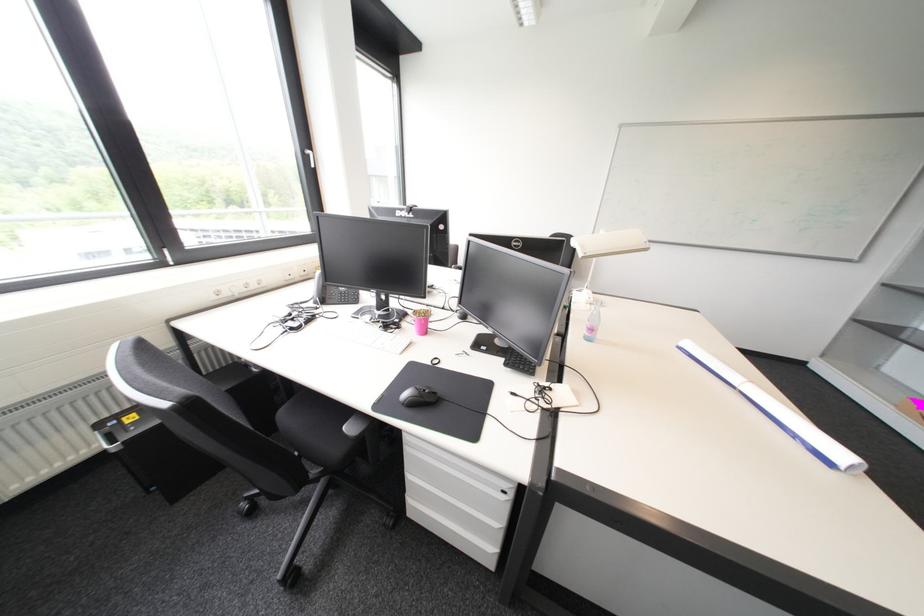
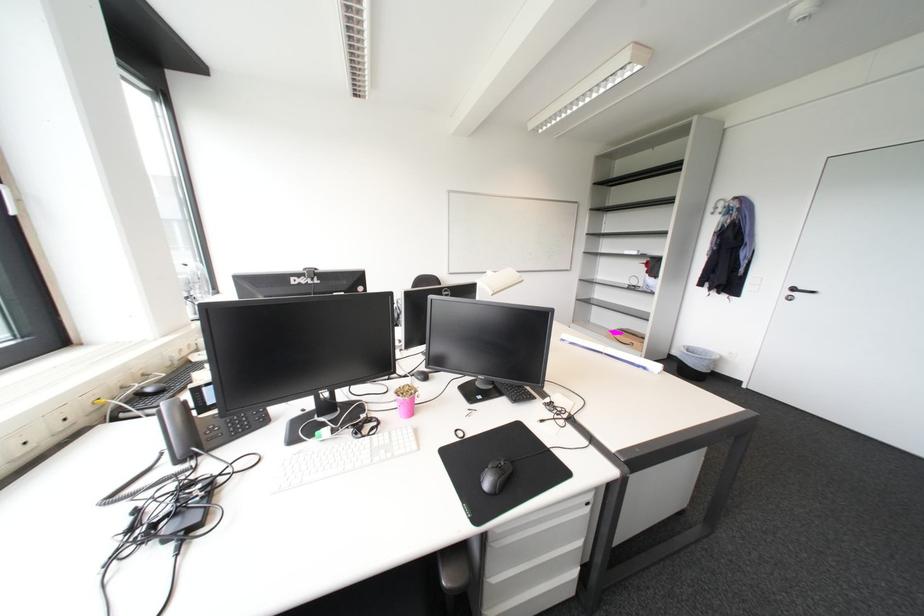
The point at (516, 347) is marked in the first image. Where is the corresponding point in the second image?

(502, 387)